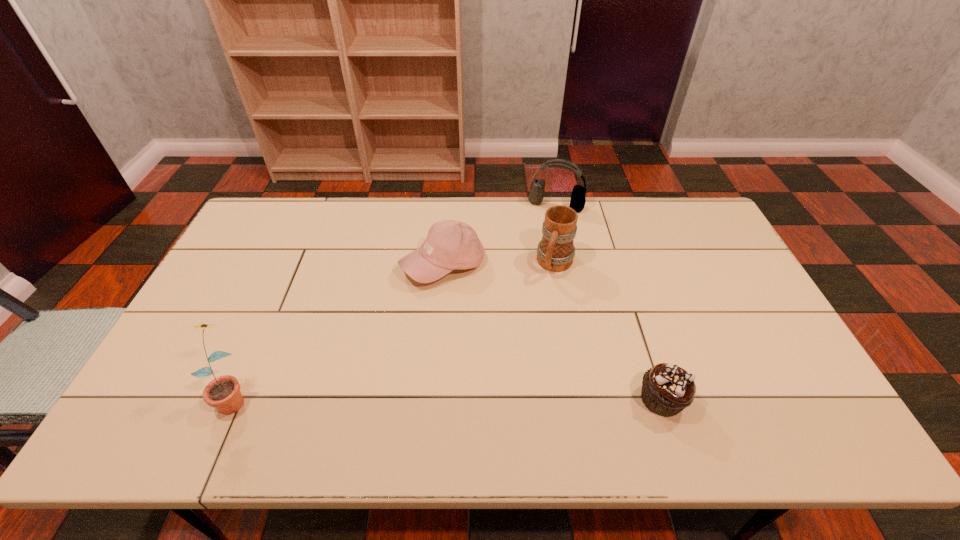
Locate an element on the screen. free space on the desktop that is between the sunflower and the shortest object and is positioned on the front-facing side of the baseball cap is located at coordinates (435, 397).

Locate an element on the screen. vacant space on the desktop that is between the sunflower and the shortest object and is positioned on the headband of the headset is located at coordinates (487, 398).

What are the coordinates of `free space on the desktop that is between the leftmost object and the cupcake and is positioned on the side of the mug with the handle` in the screenshot? It's located at (x=494, y=398).